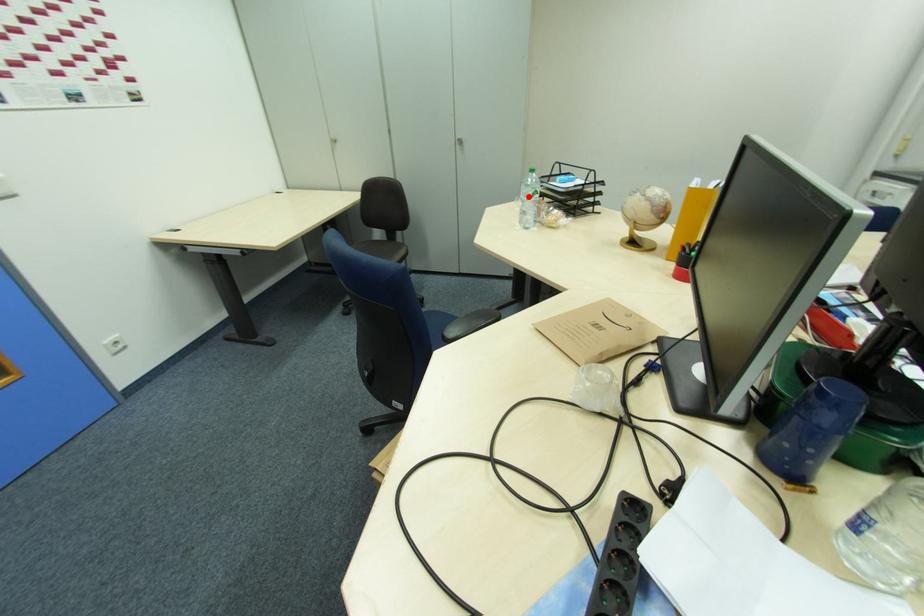
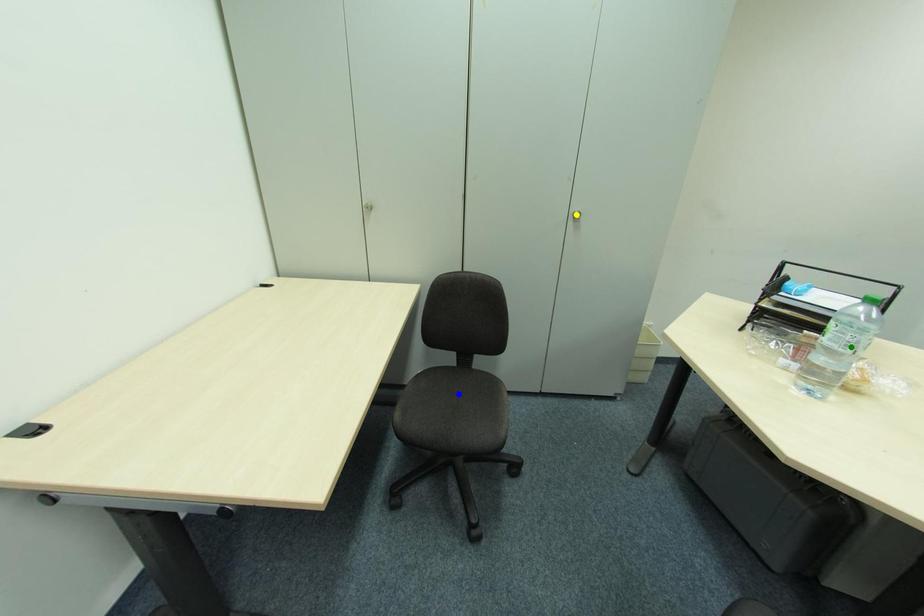
Question: I am providing you with two images of the same scene from different viewpoints. A red point is marked on the first image. You are given multiple points on the second image. Which point in image 2 is actually the same real-world point as the red point in image 1?

Choices:
 (A) yellow point
 (B) blue point
 (C) green point

Answer: (C)